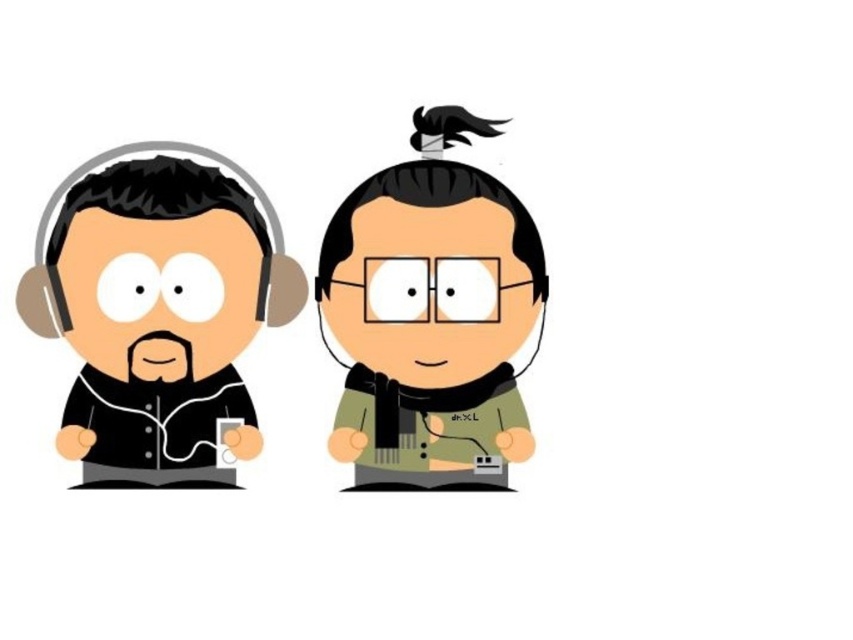
The image size is (853, 640). What do you see at coordinates (158, 316) in the screenshot? I see `black matte headphones at left` at bounding box center [158, 316].

Locate an element on the screen. black matte headphones at left is located at coordinates (158, 316).

What do you see at coordinates (158, 316) in the screenshot?
I see `black matte headphones at left` at bounding box center [158, 316].

At what (x,y) coordinates should I click in order to perform the action: click on black matte headphones at left. Please return your answer as a coordinate pair (x, y). Looking at the image, I should click on (158, 316).